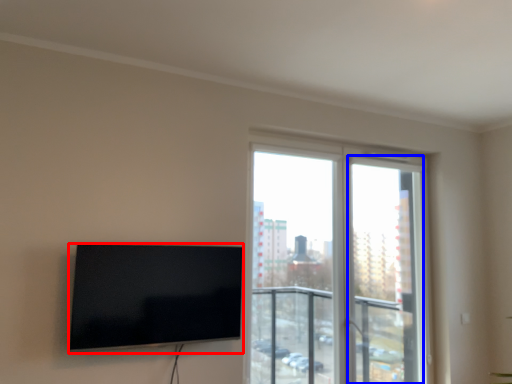
Question: Which object appears farthest to the camera in this image, television (highlighted by a red box) or screen door (highlighted by a blue box)?

Choices:
 (A) television
 (B) screen door

Answer: (B)